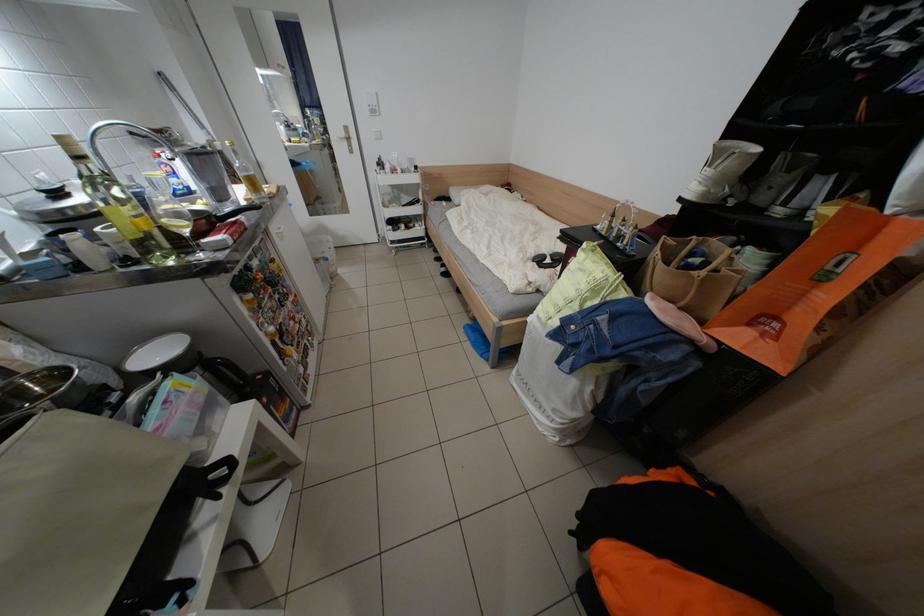
Describe the element at coordinates (724, 264) in the screenshot. Image resolution: width=924 pixels, height=616 pixels. I see `the brown bag handle` at that location.